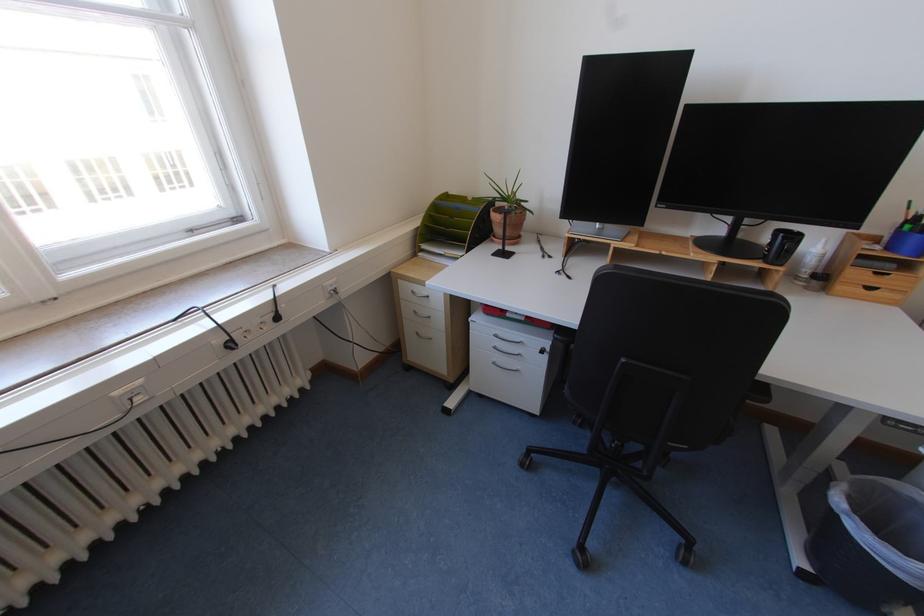
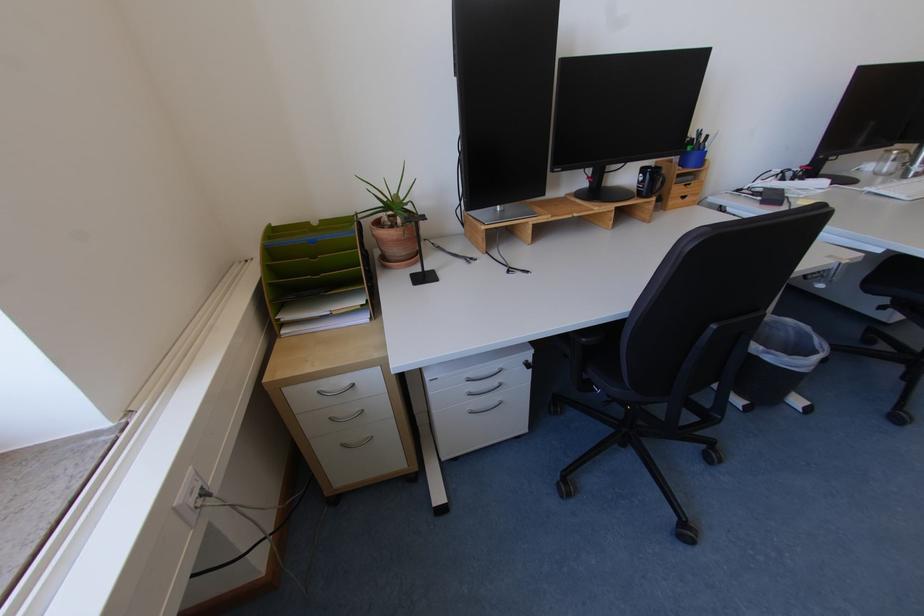
Question: Based on the continuous images, in which direction is the camera rotating? Reply with the corresponding letter.

Choices:
 (A) Left
 (B) Right
 (C) Up
 (D) Down

Answer: (B)